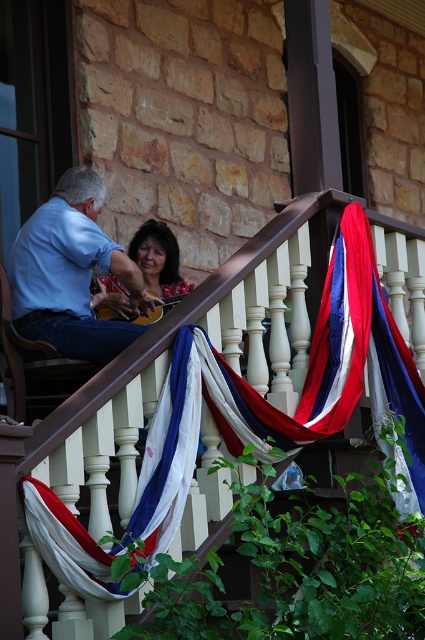
Question: Estimate the real-world distances between objects in this image. Which object is closer to the white wood railing at upper center?

Choices:
 (A) matte black hair at upper center
 (B) blue denim jeans at left

Answer: (B)

Question: Where is white wood railing at upper center located in relation to matte black hair at upper center in the image?

Choices:
 (A) right
 (B) left

Answer: (A)

Question: Is white wood railing at upper center above matte black hair at upper center?

Choices:
 (A) yes
 (B) no

Answer: (B)

Question: Among these points, which one is nearest to the camera?

Choices:
 (A) pyautogui.click(x=48, y=240)
 (B) pyautogui.click(x=48, y=480)
 (C) pyautogui.click(x=169, y=241)

Answer: (B)

Question: Which of these objects is positioned closest to the matte black hair at upper center?

Choices:
 (A) blue denim jeans at left
 (B) white wood railing at upper center

Answer: (A)

Question: Is white wood railing at upper center below matte black hair at upper center?

Choices:
 (A) yes
 (B) no

Answer: (A)